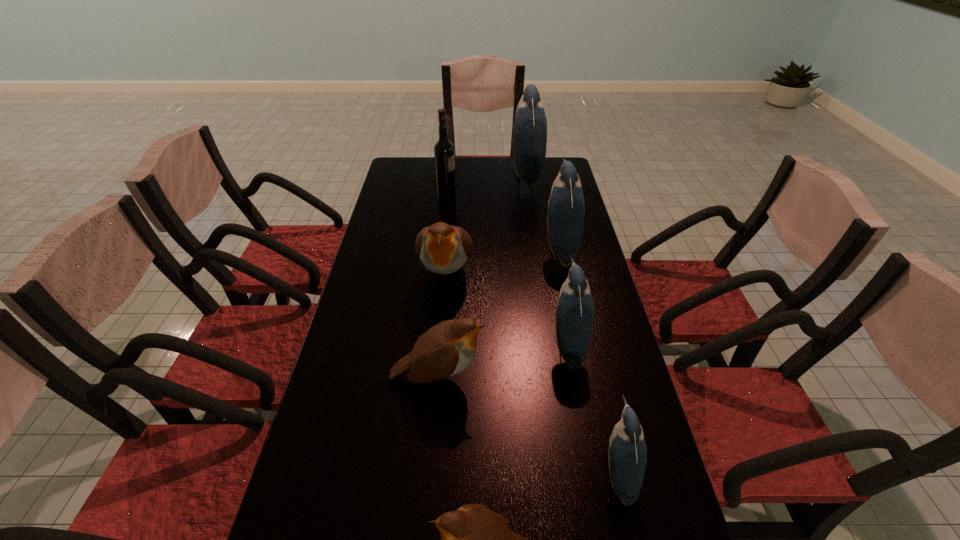
I want to click on free space at the right edge of the desktop, so click(606, 345).

Where is `empty space between the sixth shortest bird and the farthest brown bird`? The width and height of the screenshot is (960, 540). empty space between the sixth shortest bird and the farthest brown bird is located at coordinates (503, 263).

This screenshot has width=960, height=540. I want to click on unoccupied area between the third biggest blue bird and the second smallest brown bird, so click(503, 361).

What are the coordinates of `free area in between the farthest blue bird and the second tallest bird` in the screenshot? It's located at (542, 214).

Image resolution: width=960 pixels, height=540 pixels. I want to click on free space between the second smallest blue bird and the tallest bird, so click(546, 261).

Locate an element on the screen. Image resolution: width=960 pixels, height=540 pixels. empty location between the second farthest blue bird and the smallest blue bird is located at coordinates [588, 360].

What are the coordinates of `the second closest object to the biggest blue bird` in the screenshot? It's located at (444, 157).

I want to click on object that stands as the third closest to the second nearest blue bird, so click(446, 349).

Identify the location of the second closest bird to the shortest bird. The image size is (960, 540). (446, 349).

You are a GUI agent. You are given a task and a screenshot of the screen. Output one action in this format:
    pyautogui.click(x=<x>, y=<y>)
    Task: Click on the bird object that ranks as the sixth closest to the third farthest blue bird
    Image resolution: width=960 pixels, height=540 pixels.
    Given the screenshot: What is the action you would take?
    pyautogui.click(x=530, y=126)